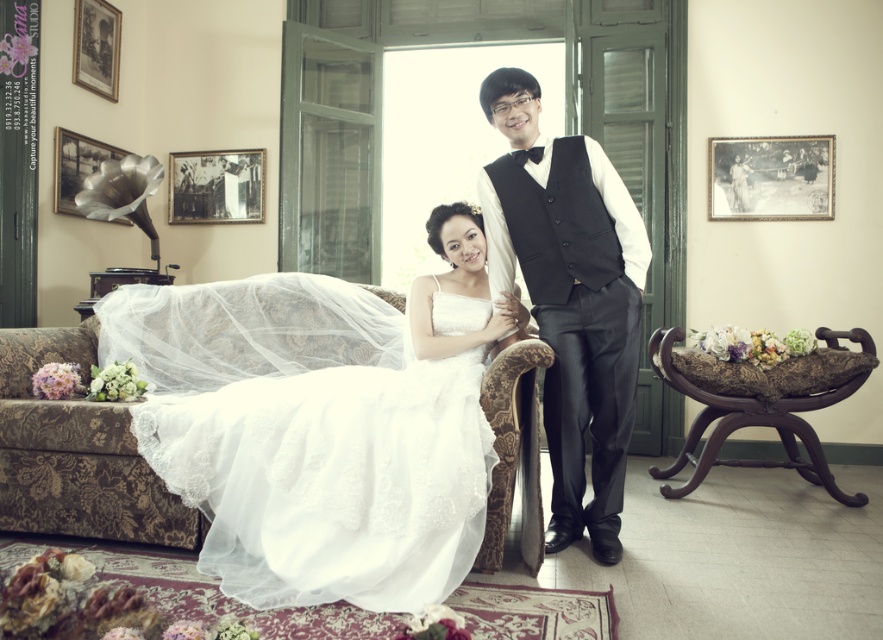
Question: Does white lace dress at center appear on the left side of brown wood armchair at right?

Choices:
 (A) no
 (B) yes

Answer: (B)

Question: Does white lace dress at center appear under black satin vest at center?

Choices:
 (A) yes
 (B) no

Answer: (A)

Question: Considering the relative positions of black satin vest at center and brown wood armchair at right in the image provided, where is black satin vest at center located with respect to brown wood armchair at right?

Choices:
 (A) above
 (B) below

Answer: (A)

Question: Which point is closer to the camera taking this photo?

Choices:
 (A) (703, 408)
 (B) (563, 172)
 (C) (311, 602)

Answer: (C)

Question: Estimate the real-world distances between objects in this image. Which object is closer to the white lace dress at center?

Choices:
 (A) brown wood armchair at right
 (B) black satin vest at center

Answer: (B)

Question: Among these objects, which one is nearest to the camera?

Choices:
 (A) white lace dress at center
 (B) black satin vest at center

Answer: (A)